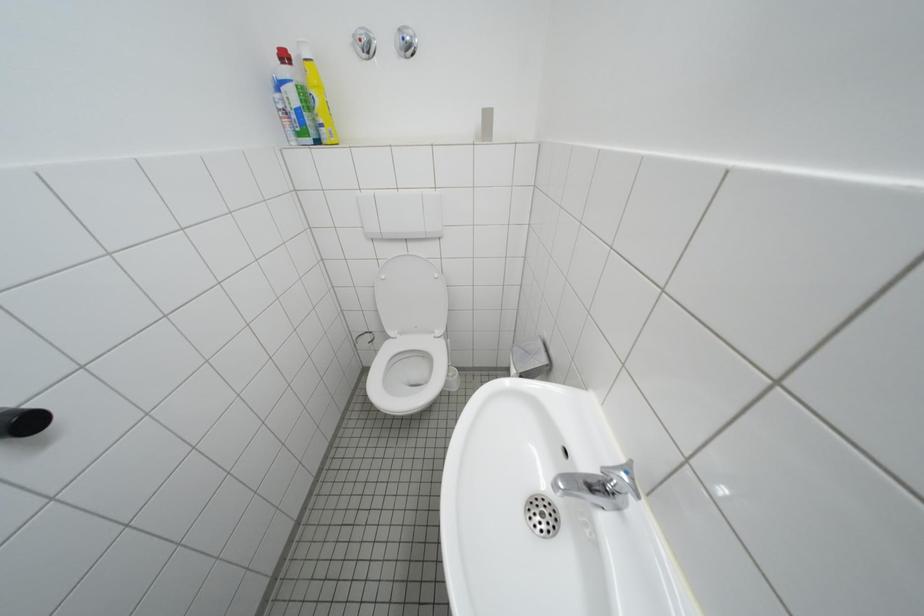
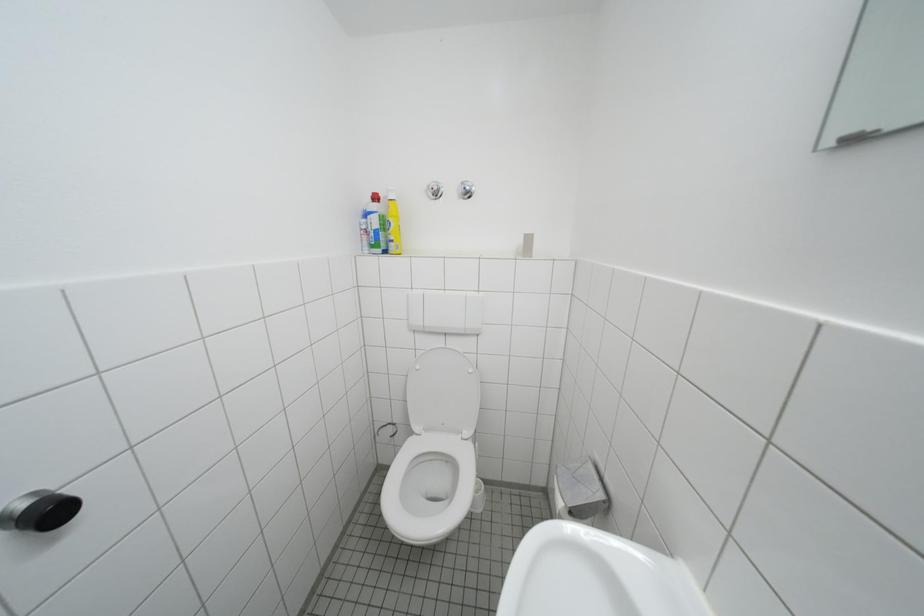
Question: What movement of the cameraman would produce the second image?

Choices:
 (A) Left
 (B) Right
 (C) Forward
 (D) Backward

Answer: (A)